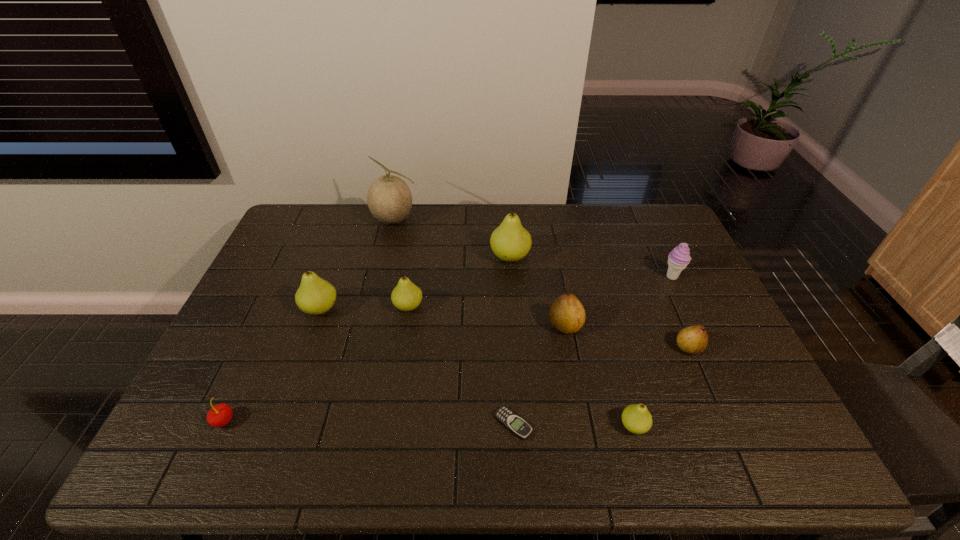
At what (x,y) coordinates should I click in order to perform the action: click on vacant area that lies between the purple icecream and the leftmost object. Please return your answer as a coordinate pair (x, y). The image size is (960, 540). Looking at the image, I should click on (448, 349).

Locate an element on the screen. This screenshot has height=540, width=960. the seventh closest object to the left brown pear is located at coordinates (389, 198).

Locate an element on the screen. object that stands as the seventh closest to the third object from right to left is located at coordinates (315, 296).

The image size is (960, 540). Find the location of `pear that is the closest to the right brown pear`. pear that is the closest to the right brown pear is located at coordinates (636, 418).

Identify which pear is located as the nearest to the fifth pear from right to left. Please provide its 2D coordinates. Your answer should be formatted as a tuple, i.e. [(x, y)], where the tuple contains the x and y coordinates of a point satisfying the conditions above.

[(315, 296)]

Identify which green pear is the fourth nearest to the beeper. Please provide its 2D coordinates. Your answer should be formatted as a tuple, i.e. [(x, y)], where the tuple contains the x and y coordinates of a point satisfying the conditions above.

[(315, 296)]

Select which green pear is the fourth closest to the purple icecream. Please provide its 2D coordinates. Your answer should be formatted as a tuple, i.e. [(x, y)], where the tuple contains the x and y coordinates of a point satisfying the conditions above.

[(315, 296)]

Image resolution: width=960 pixels, height=540 pixels. In order to click on vacant space that satisfies the following two spatial constraints: 1. on the back side of the fourth object from right to left; 2. on the right side of the beeper in this screenshot , I will do `click(508, 326)`.

Find the location of a particular element. This screenshot has height=540, width=960. free location that satisfies the following two spatial constraints: 1. on the front side of the rightmost pear; 2. on the left side of the second green pear from right to left is located at coordinates (517, 348).